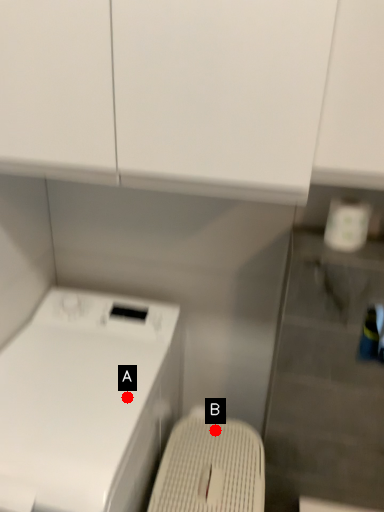
Question: Two points are circled on the image, labeled by A and B beside each circle. Which point is closer to the camera?

Choices:
 (A) A is closer
 (B) B is closer

Answer: (A)